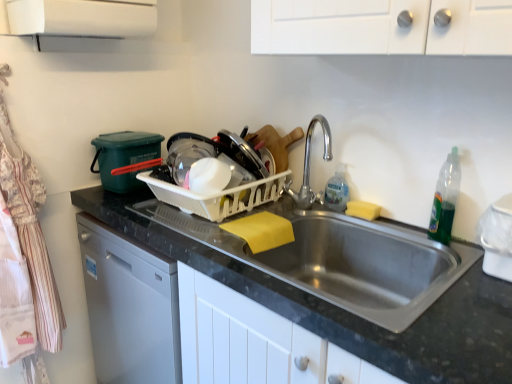
Question: In terms of height, does white plastic basket at center look taller or shorter compared to green translucent bottle at right?

Choices:
 (A) short
 (B) tall

Answer: (A)

Question: Considering the positions of point (280, 177) and point (439, 231), is point (280, 177) closer or farther from the camera than point (439, 231)?

Choices:
 (A) farther
 (B) closer

Answer: (A)

Question: Which object is the farthest from the clear plastic bottle at sink?

Choices:
 (A) yellow sponge at sink right
 (B) green translucent bottle at right
 (C) white plastic basket at center
 (D) black granite countertop at center
 (E) striped cotton apron at left

Answer: (E)

Question: Which object is the farthest from the striped cotton apron at left?

Choices:
 (A) yellow sponge at sink right
 (B) white plastic basket at center
 (C) clear plastic bottle at sink
 (D) black granite countertop at center
 (E) green translucent bottle at right

Answer: (E)